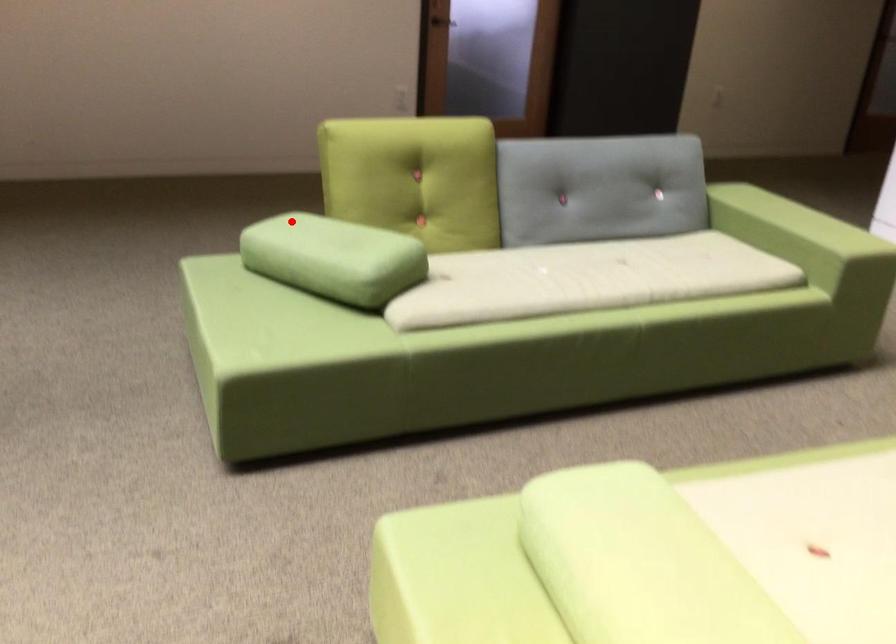
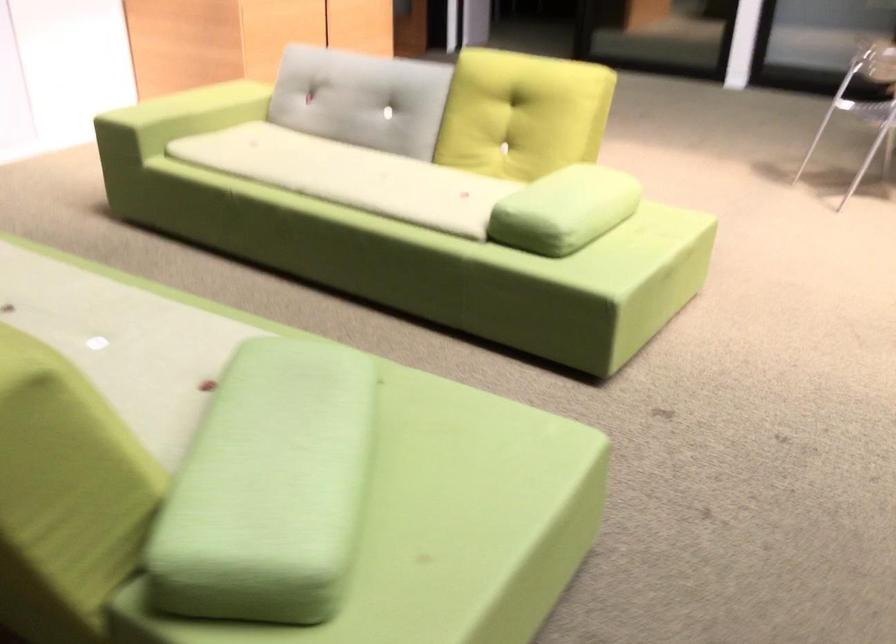
The point at the highlighted location is marked in the first image. Where is the corresponding point in the second image?

(269, 488)